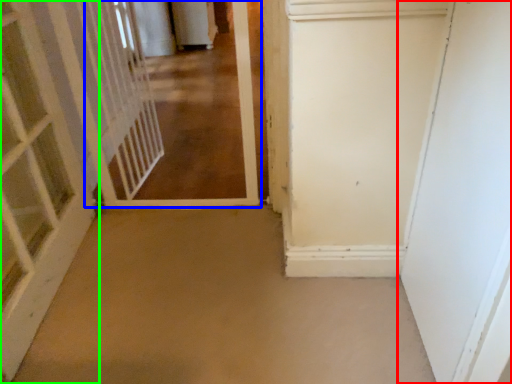
Question: Which object is the farthest from door (highlighted by a red box)? Choose among these: corridor (highlighted by a blue box) or door (highlighted by a green box).

Choices:
 (A) corridor
 (B) door

Answer: (B)